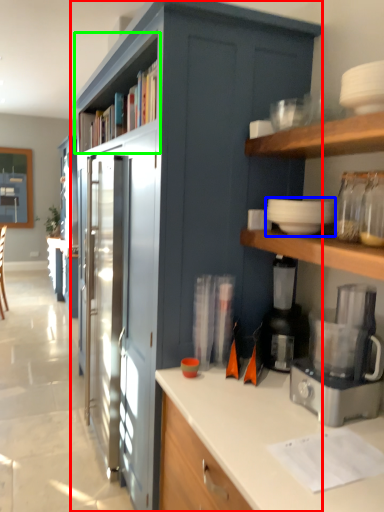
Question: Considering the real-world distances, which object is farthest from cabinetry (highlighted by a red box)? appliance (highlighted by a blue box) or shelf (highlighted by a green box)?

Choices:
 (A) appliance
 (B) shelf

Answer: (A)